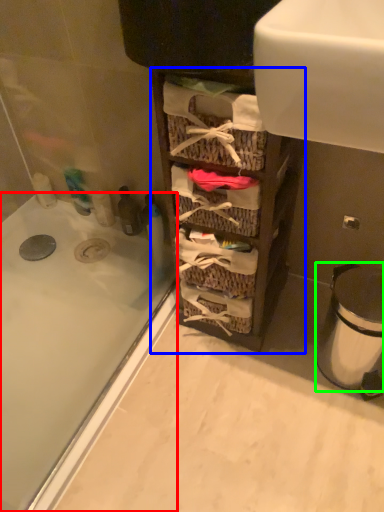
Question: Which object is the farthest from bathtub (highlighted by a red box)? Choose among these: cabinetry (highlighted by a blue box) or trash bin/can (highlighted by a green box).

Choices:
 (A) cabinetry
 (B) trash bin/can

Answer: (B)